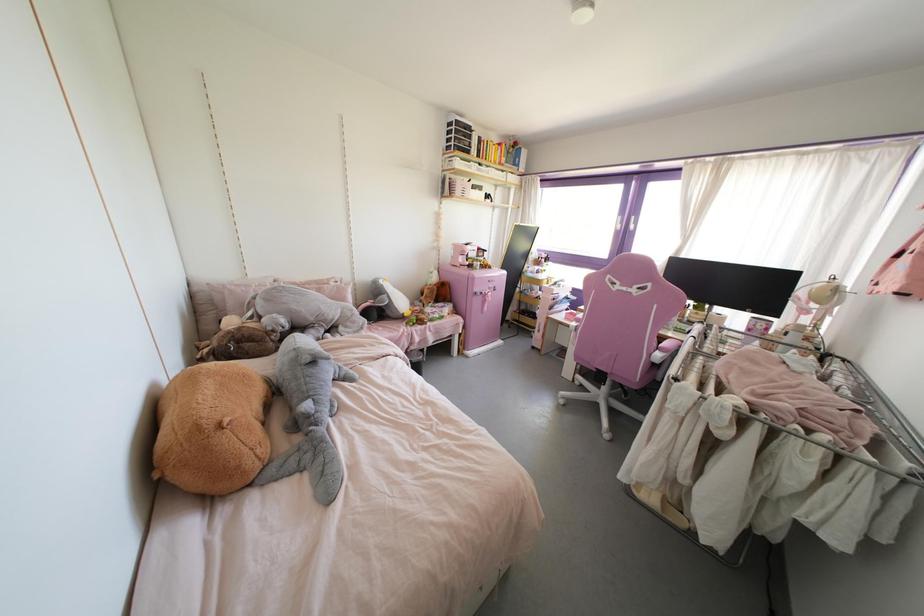
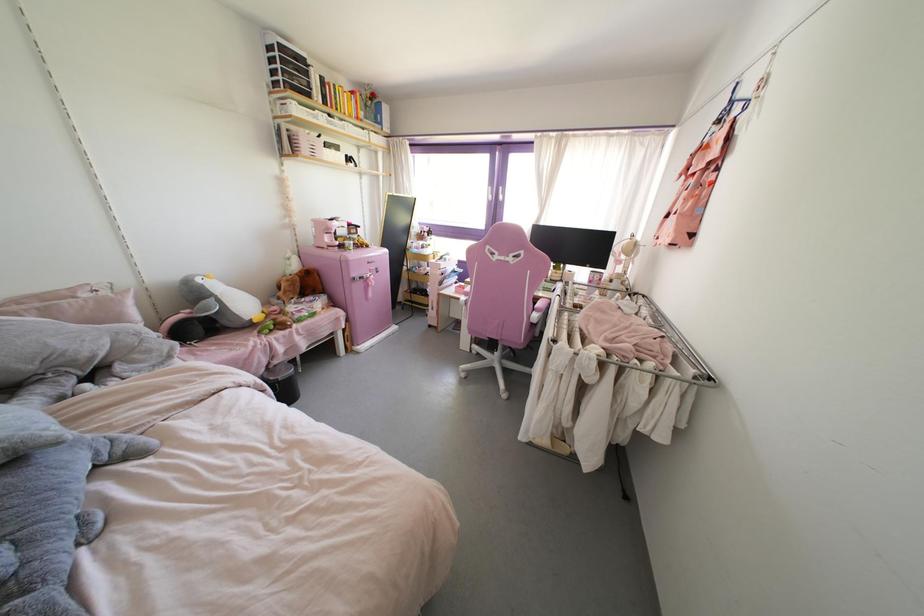
Where in the second image is the point corresponding to [493,290] from the first image?

(377, 272)